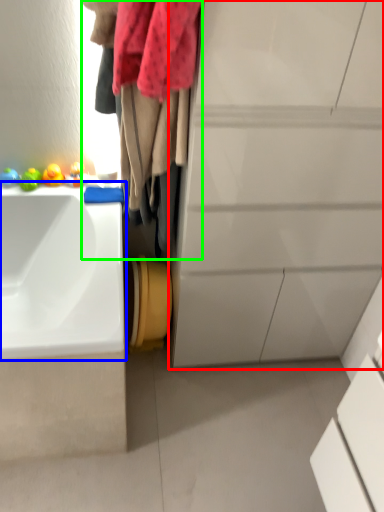
Question: Which object is positioned farthest from bathroom cabinet (highlighted by a red box)? Select from sink (highlighted by a blue box) and laundry (highlighted by a green box).

Choices:
 (A) sink
 (B) laundry

Answer: (A)